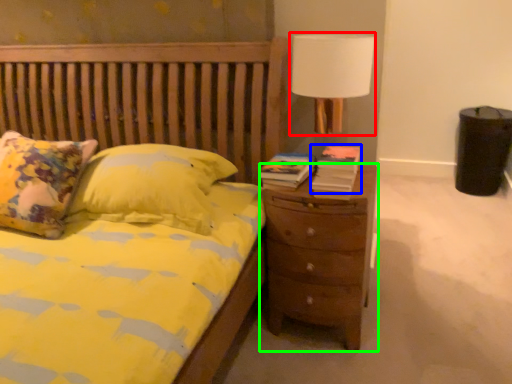
Question: Which object is positioned farthest from lamp (highlighted by a red box)? Select from book (highlighted by a blue box) and nightstand (highlighted by a green box).

Choices:
 (A) book
 (B) nightstand

Answer: (B)